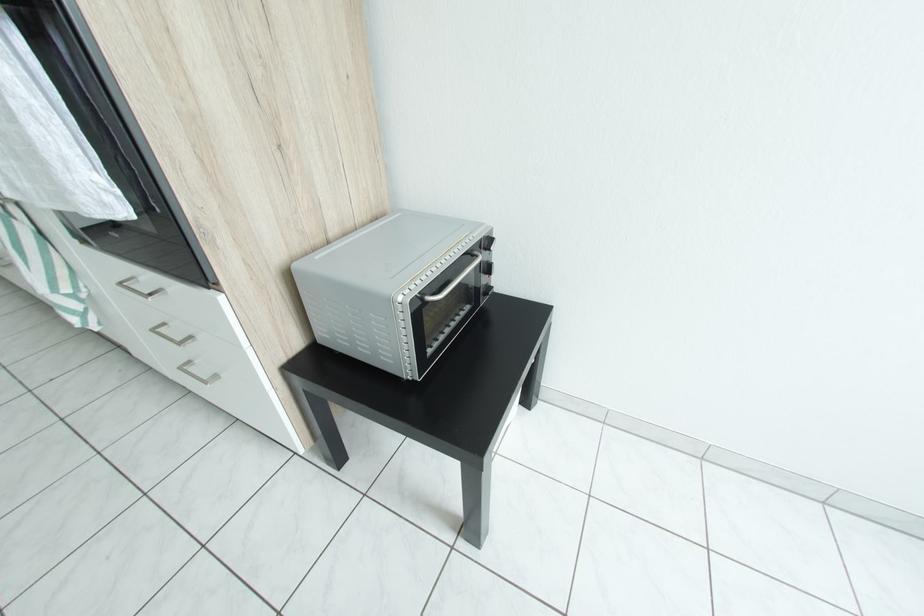
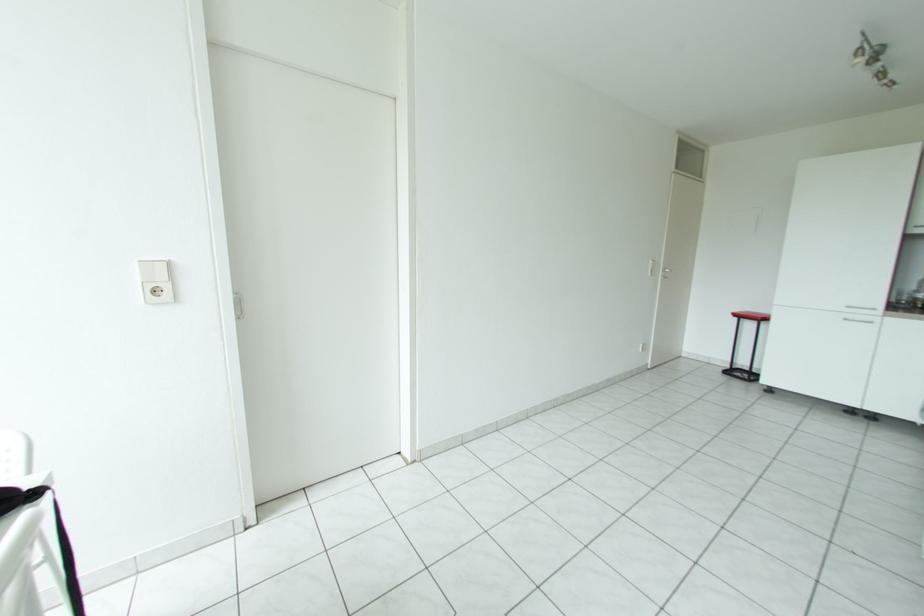
Looking at this image, how did the camera likely rotate?

The camera's rotation is toward left-down.